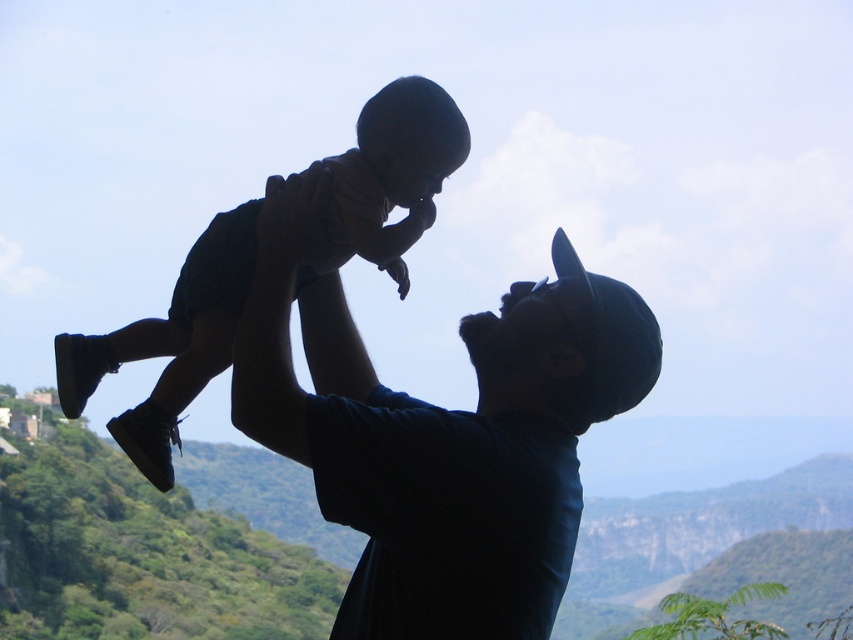
You are a photographer trying to capture the scene of the dark blue shirt at upper center and the silhouette baby at center. Based on their positions, which object is to the right of the other?

The dark blue shirt at upper center is positioned on the right side of silhouette baby at center.

You are an observer looking at the image. There is a dark blue shirt at upper center. Can you determine its exact position in terms of coordinates?

The dark blue shirt at upper center is located at point (440, 435).